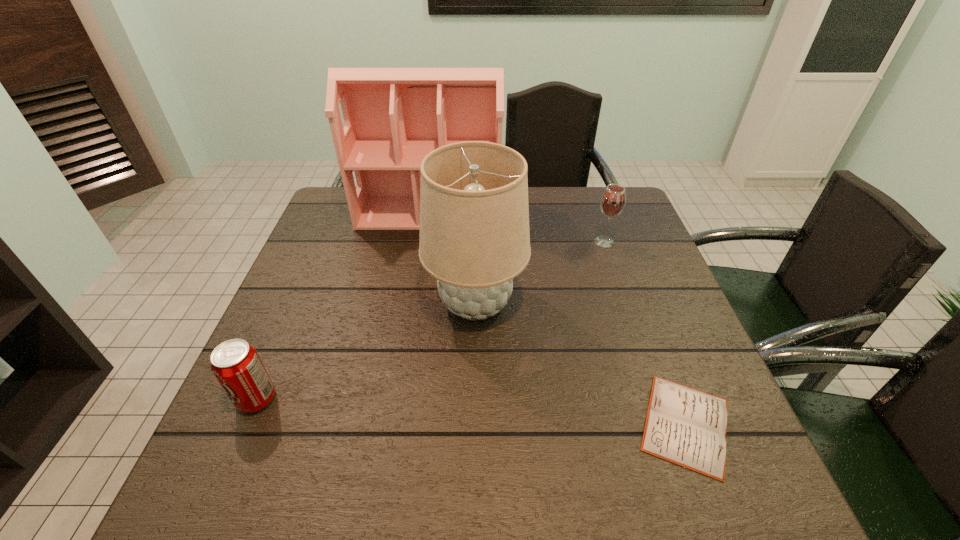
This screenshot has height=540, width=960. In order to click on blank space at the far edge of the desktop in this screenshot , I will do `click(553, 226)`.

This screenshot has width=960, height=540. I want to click on vacant position at the near edge of the desktop, so click(x=537, y=480).

Identify the location of vacant space at the left edge of the desktop. (355, 272).

In the image, there is a desktop. At what (x,y) coordinates should I click in order to perform the action: click on vacant space at the right edge. Please return your answer as a coordinate pair (x, y). The width and height of the screenshot is (960, 540). Looking at the image, I should click on (630, 264).

Where is `vacant space at the near left corner of the desktop`? vacant space at the near left corner of the desktop is located at coordinates (211, 488).

In the image, there is a desktop. Where is `vacant area at the far right corner`? This screenshot has height=540, width=960. vacant area at the far right corner is located at coordinates (606, 187).

Where is `free point at the near right corner`? Image resolution: width=960 pixels, height=540 pixels. free point at the near right corner is located at coordinates (778, 511).

The image size is (960, 540). Identify the location of free space that is in between the lampshade and the shortest object. (581, 364).

Where is `vacant region between the dollhouse and the leftmost object`? This screenshot has width=960, height=540. vacant region between the dollhouse and the leftmost object is located at coordinates (343, 306).

Where is `empty space between the diary and the soda`? empty space between the diary and the soda is located at coordinates (471, 412).